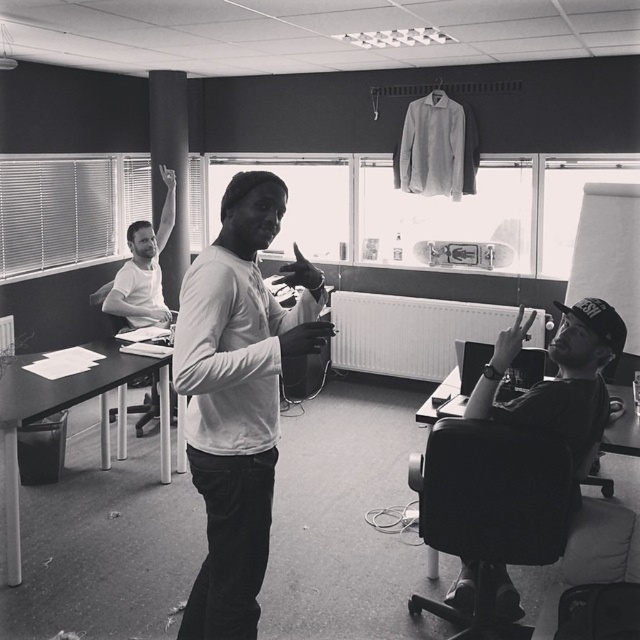
Question: Which is farther from the matte black bag at center?

Choices:
 (A) black leather swivel chair at lower right
 (B) white matte shirt at center
 (C) matte black hand at right
 (D) smooth black cap at right

Answer: (B)

Question: Is smooth black cap at right thinner than black matte hand at center?

Choices:
 (A) yes
 (B) no

Answer: (B)

Question: Which of these objects is positioned closest to the matte black hand at right?

Choices:
 (A) black matte hand at center
 (B) white matte long-sleeve shirt at center
 (C) white matte shirt at center

Answer: (B)

Question: In this image, where is smooth black cap at right located relative to black matte hand at center?

Choices:
 (A) above
 (B) below

Answer: (B)

Question: Does white matte long-sleeve shirt at center appear on the right side of black matte hand at center?

Choices:
 (A) no
 (B) yes

Answer: (B)

Question: Estimate the real-world distances between objects in this image. Which object is closer to the black matte hand at center?

Choices:
 (A) white matte long-sleeve shirt at center
 (B) matte black hand at right
 (C) white matte shirt at center
 (D) matte black bag at center

Answer: (C)